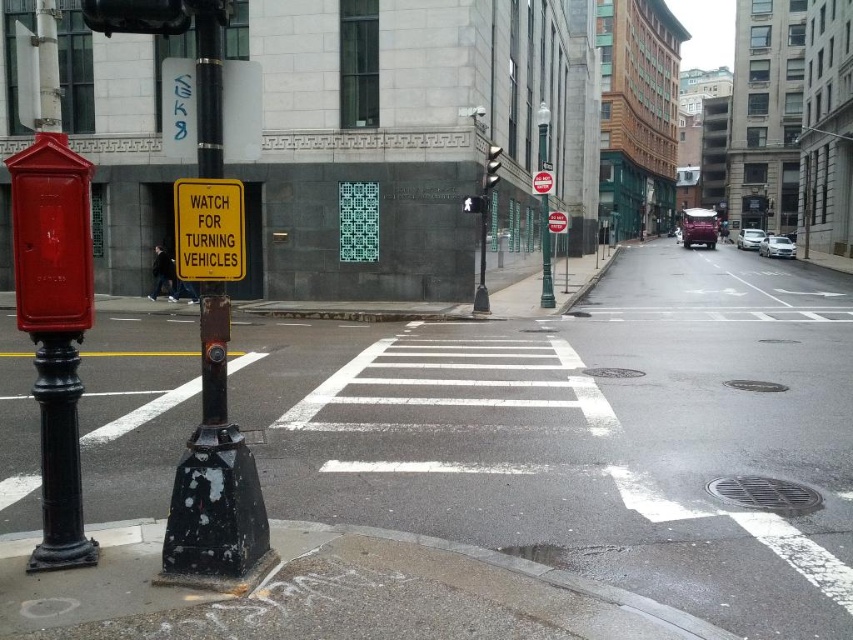
Question: Does green metallic pole at center appear on the left side of metallic traffic light at center?

Choices:
 (A) yes
 (B) no

Answer: (B)

Question: Which object is the closest to the metallic rectangular sign at center?

Choices:
 (A) yellow plastic sign at center
 (B) metallic traffic light at center
 (C) metallic reflective sign at center

Answer: (C)

Question: In this image, where is metallic reflective sign at center located relative to metallic at center?

Choices:
 (A) left
 (B) right

Answer: (B)

Question: Which object is the closest to the metallic rectangular sign at center?

Choices:
 (A) metallic at center
 (B) green metallic pole at center
 (C) black metal pole at left
 (D) yellow plastic sign at center

Answer: (A)

Question: From the image, what is the correct spatial relationship of green metallic pole at center in relation to metallic reflective sign at center?

Choices:
 (A) right
 (B) left

Answer: (A)

Question: Which point is closer to the camera?

Choices:
 (A) yellow plastic sign at center
 (B) metallic at center
 (C) metallic reflective sign at center
 (D) green metallic pole at center

Answer: (A)